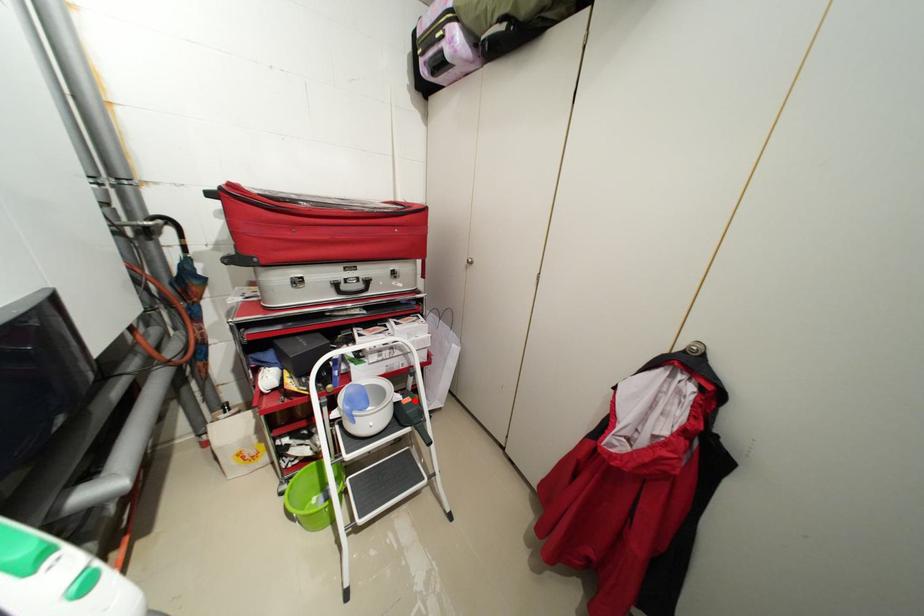
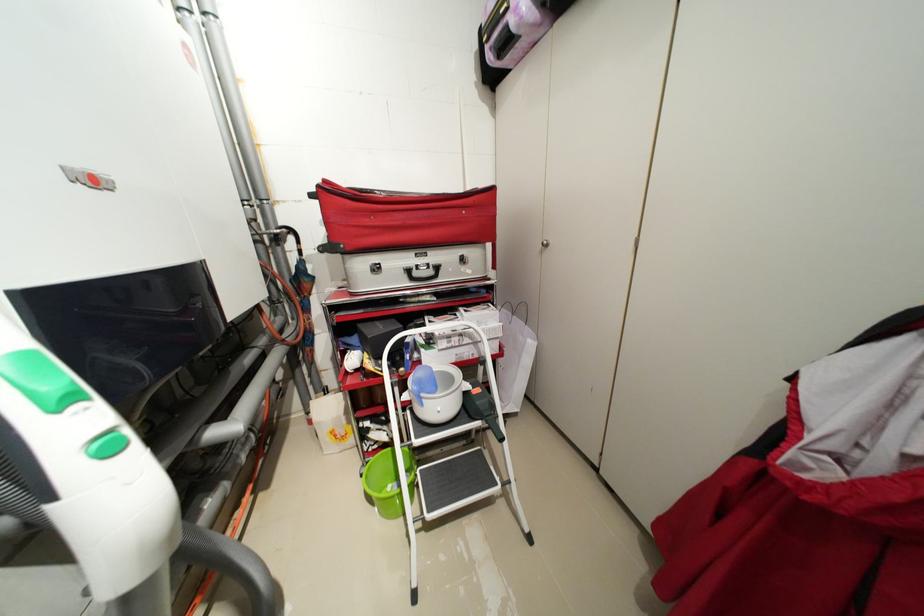
Locate, in the second image, the point that corresponds to the highlighted location in the first image.

(484, 391)